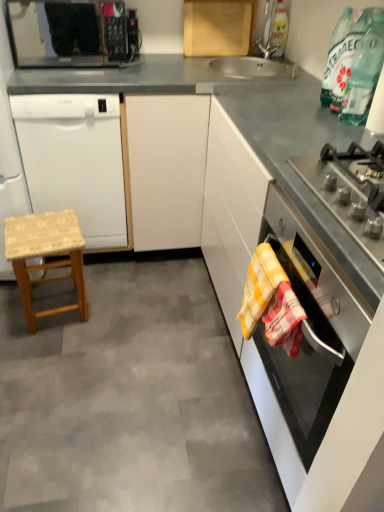
Question: From the image's perspective, is black matte microwave at upper left located beneath satin silver gas stove at right?

Choices:
 (A) no
 (B) yes

Answer: (A)

Question: From a real-world perspective, is black matte microwave at upper left located higher than satin silver gas stove at right?

Choices:
 (A) no
 (B) yes

Answer: (B)

Question: From the image's perspective, is black matte microwave at upper left over satin silver gas stove at right?

Choices:
 (A) yes
 (B) no

Answer: (A)

Question: Is black matte microwave at upper left positioned with its back to satin silver gas stove at right?

Choices:
 (A) yes
 (B) no

Answer: (B)

Question: Can you confirm if black matte microwave at upper left is wider than satin silver gas stove at right?

Choices:
 (A) no
 (B) yes

Answer: (A)

Question: From a real-world perspective, is black matte microwave at upper left physically below satin silver gas stove at right?

Choices:
 (A) yes
 (B) no

Answer: (B)

Question: Is the position of woven wood stool at lower left less distant than that of yellow checkered towel at lower right, the second blanket when ordered from front to back?

Choices:
 (A) no
 (B) yes

Answer: (A)

Question: Is woven wood stool at lower left bigger than yellow checkered towel at lower right, which is the first blanket in back-to-front order?

Choices:
 (A) no
 (B) yes

Answer: (B)

Question: Considering the relative positions of woven wood stool at lower left and yellow checkered towel at lower right, which is the first blanket in back-to-front order, in the image provided, is woven wood stool at lower left to the right of yellow checkered towel at lower right, which is the first blanket in back-to-front order, from the viewer's perspective?

Choices:
 (A) yes
 (B) no

Answer: (B)

Question: Is woven wood stool at lower left at the left side of yellow checkered towel at lower right, the second blanket when ordered from front to back?

Choices:
 (A) no
 (B) yes

Answer: (B)

Question: Is woven wood stool at lower left not close to yellow checkered towel at lower right, which is the first blanket in back-to-front order?

Choices:
 (A) no
 (B) yes

Answer: (B)

Question: Can you confirm if woven wood stool at lower left is taller than yellow checkered towel at lower right, the second blanket when ordered from front to back?

Choices:
 (A) no
 (B) yes

Answer: (B)

Question: Considering the relative sizes of black matte microwave at upper left and wooden stool at left in the image provided, is black matte microwave at upper left taller than wooden stool at left?

Choices:
 (A) no
 (B) yes

Answer: (B)